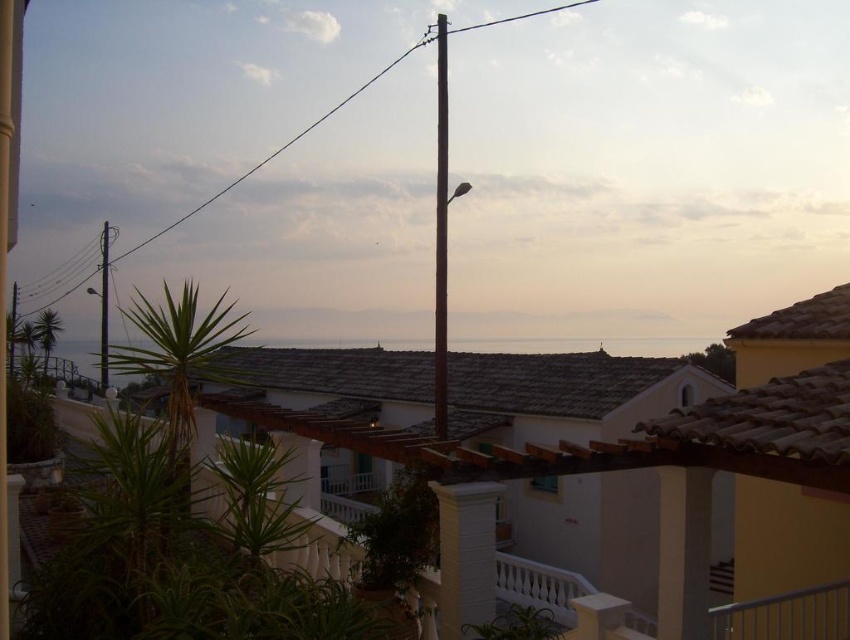
You are a tourist standing in the coastal town and want to take a photo of the black metal pole at center and the metallic pole at upper center. Which pole should you position to your left to capture both in the frame?

You should position the metallic pole at upper center to your left because the black metal pole at center is to the right of it.

You are a photographer planning to capture the coastal scene. You want to ensure the gray stone water at center and the metallic pole at upper center are both in the frame. Based on their positions, which object will appear higher in your photo?

The metallic pole at upper center appears higher in the photo because it is positioned above the gray stone water at center.

You are a tourist standing in the coastal town and see both the black metal pole at center and the brown wooden pole at center. Which pole is smaller in size?

The black metal pole at center is smaller in size compared to the brown wooden pole at center.